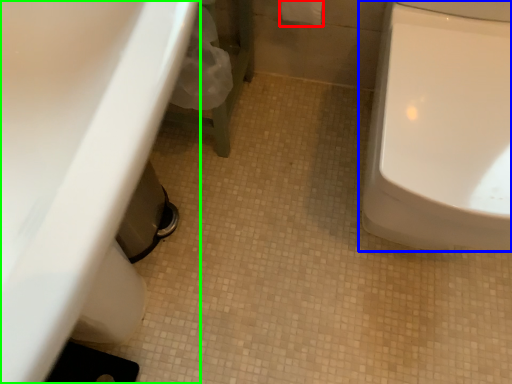
Question: Considering the real-world distances, which object is farthest from toilet paper (highlighted by a red box)? toilet (highlighted by a blue box) or sink (highlighted by a green box)?

Choices:
 (A) toilet
 (B) sink

Answer: (B)